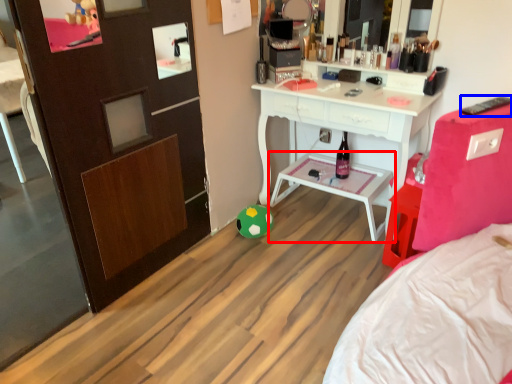
Question: Which object appears farthest to the camera in this image, table (highlighted by a red box) or remote control (highlighted by a blue box)?

Choices:
 (A) table
 (B) remote control

Answer: (A)